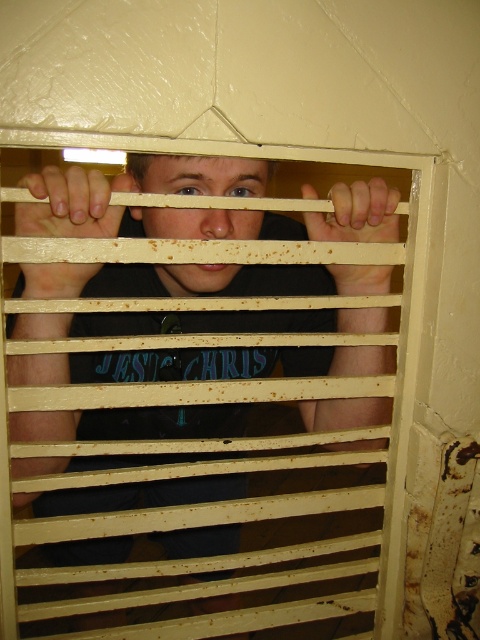
Question: Is matte black shirt at center to the left of matte wood hand at left from the viewer's perspective?

Choices:
 (A) no
 (B) yes

Answer: (A)

Question: Does matte black shirt at center have a larger size compared to matte wood hand at left?

Choices:
 (A) yes
 (B) no

Answer: (A)

Question: Is matte black shirt at center thinner than matte wood hand at left?

Choices:
 (A) yes
 (B) no

Answer: (B)

Question: Which object is farther from the camera taking this photo?

Choices:
 (A) matte wood hand at left
 (B) brown wooden hand at center

Answer: (B)

Question: Based on their relative distances, which object is farther from the matte black shirt at center?

Choices:
 (A) matte wood hand at left
 (B) brown wooden hand at center

Answer: (B)

Question: Which object is farther from the camera taking this photo?

Choices:
 (A) brown wooden hand at center
 (B) matte wood hand at left
 (C) matte black shirt at center

Answer: (A)